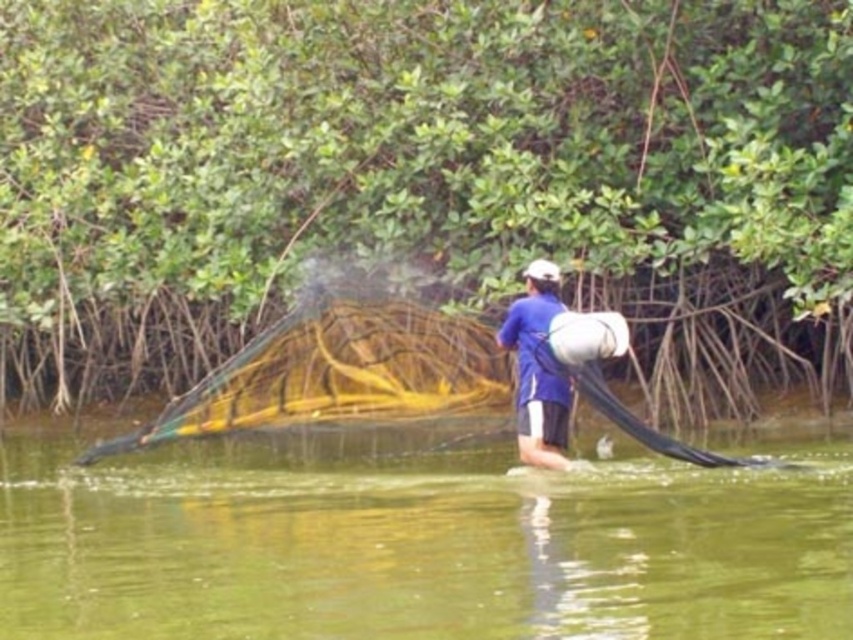
Between point (360, 259) and point (462, 483), which one is positioned in front?

Point (462, 483) is in front.

Which is above, green leafy mangrove at center or green translucent water at center?

green leafy mangrove at center is higher up.

Who is more distant from viewer, (x=630, y=225) or (x=750, y=625)?

The point (x=630, y=225) is behind.

Image resolution: width=853 pixels, height=640 pixels. What are the coordinates of `green leafy mangrove at center` in the screenshot? It's located at (425, 179).

How much distance is there between green leafy mangrove at center and blue fabric shirt at center?

green leafy mangrove at center is 4.62 meters from blue fabric shirt at center.

Does green leafy mangrove at center appear over blue fabric shirt at center?

Yes.

Find the location of a particular element. The height and width of the screenshot is (640, 853). green leafy mangrove at center is located at coordinates (425, 179).

The width and height of the screenshot is (853, 640). I want to click on green leafy mangrove at center, so click(x=425, y=179).

Can you confirm if green translucent water at center is positioned above blue fabric shirt at center?

Actually, green translucent water at center is below blue fabric shirt at center.

Who is higher up, green translucent water at center or blue fabric shirt at center?

Positioned higher is blue fabric shirt at center.

Who is more distant from viewer, [91,504] or [537,465]?

The point [537,465] is more distant.

Where is `green translucent water at center`? Image resolution: width=853 pixels, height=640 pixels. green translucent water at center is located at coordinates (421, 541).